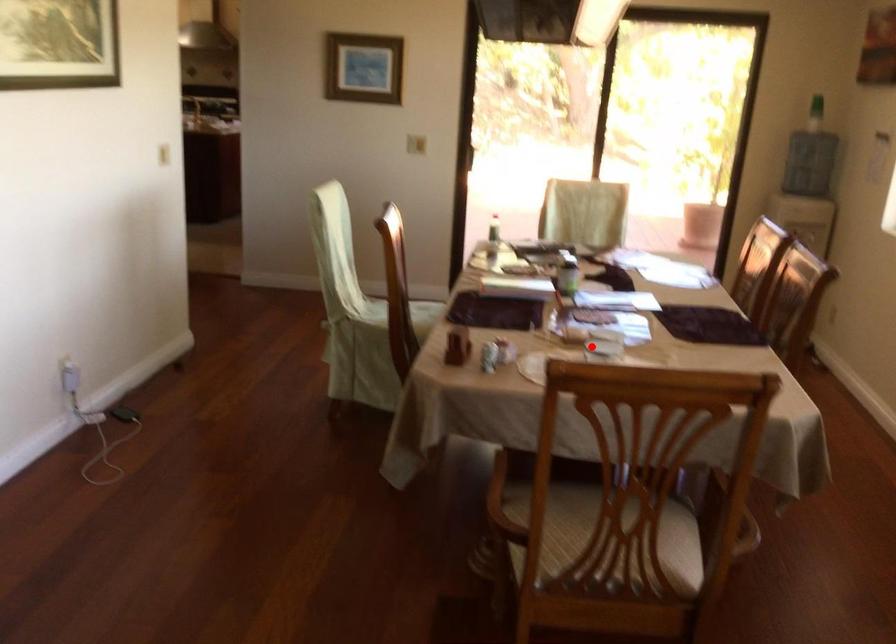
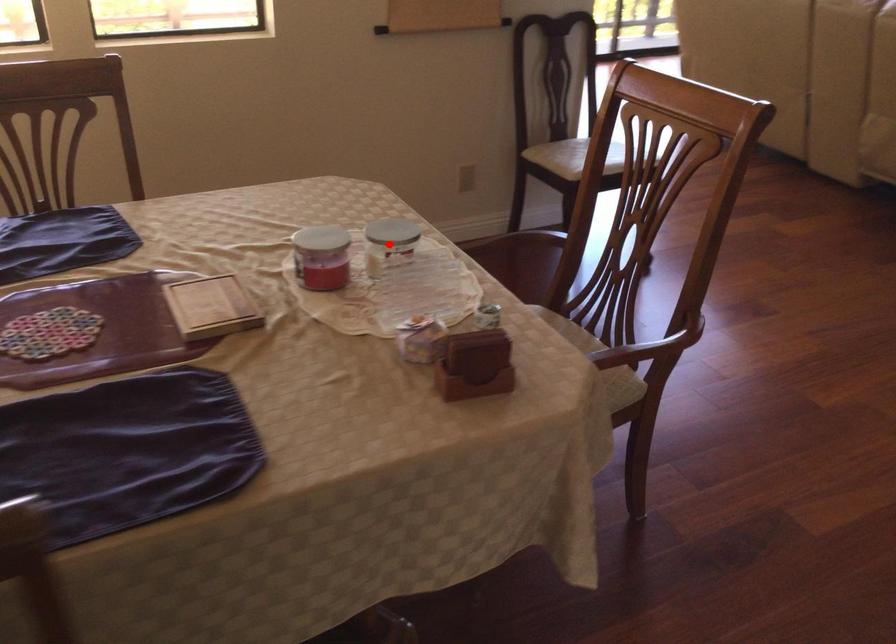
I am providing you with two images of the same scene from different viewpoints. A red point is marked on the first image and another point is marked on the second image. Do the highlighted points in image1 and image2 indicate the same real-world spot?

Yes